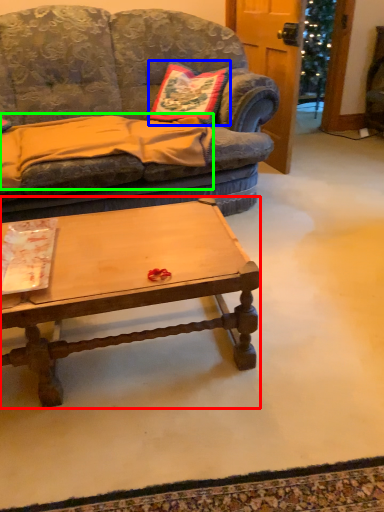
Question: Which is nearer to the coffee table (highlighted by a red box)? pillow (highlighted by a blue box) or blanket (highlighted by a green box).

Choices:
 (A) pillow
 (B) blanket

Answer: (B)